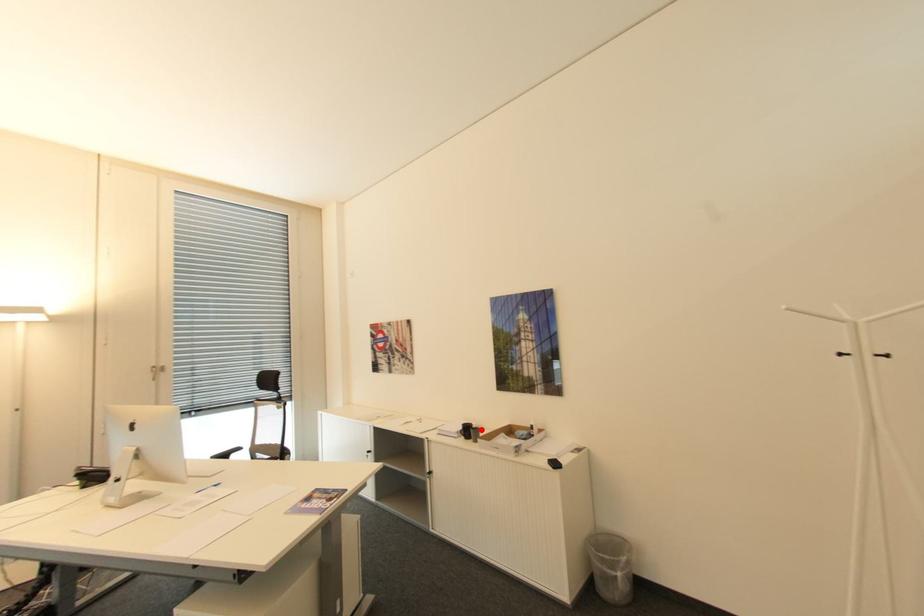
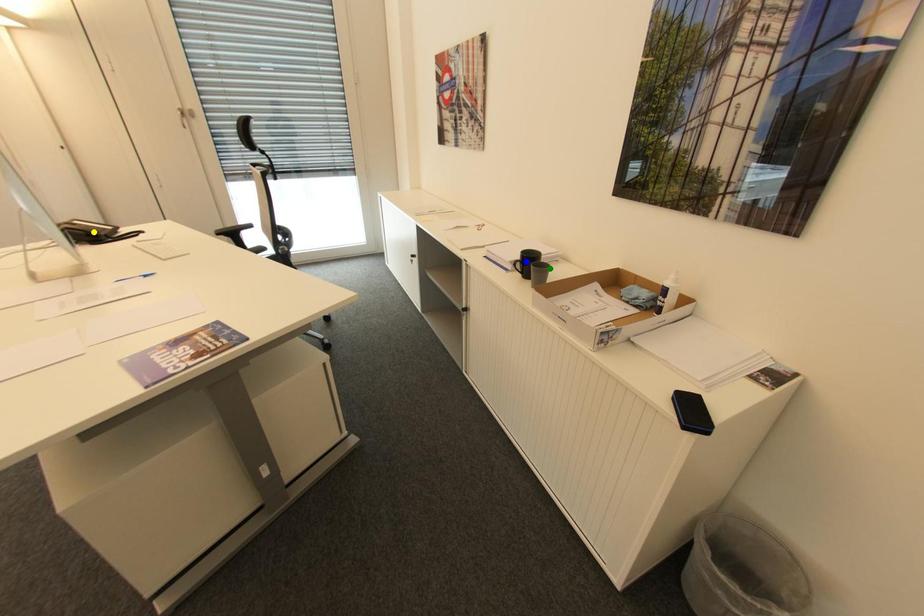
Question: I am providing you with two images of the same scene from different viewpoints. A red point is marked on the first image. You are given multiple points on the second image. Which mark in image 2 goes with the point in image 1?

Choices:
 (A) yellow point
 (B) blue point
 (C) green point

Answer: (C)